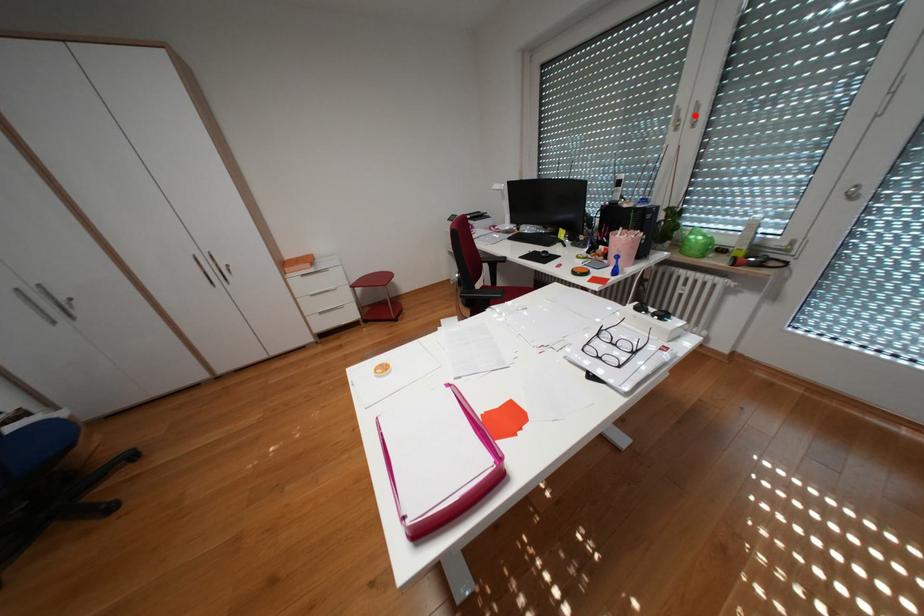
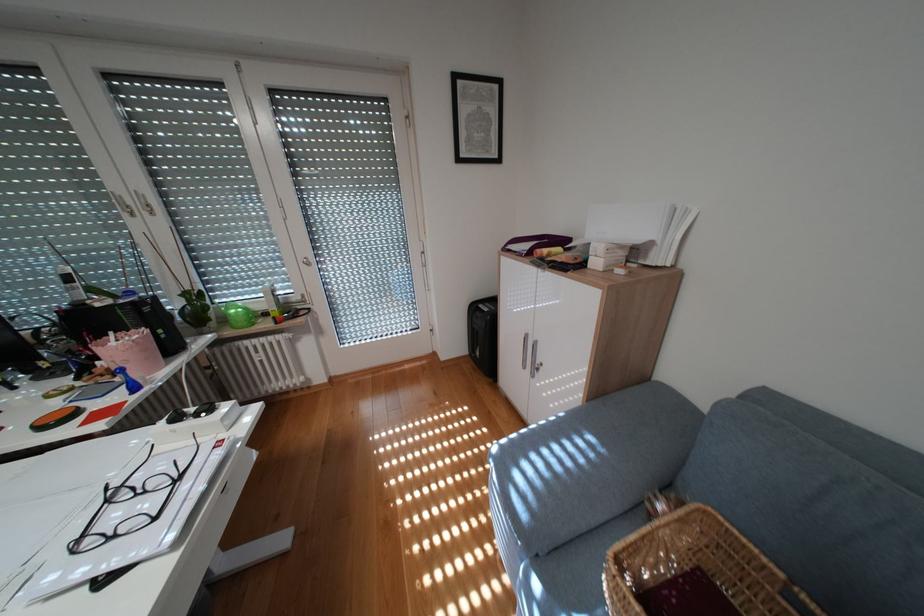
Find the pixel in the second image that matches the highlighted location in the first image.

(141, 201)